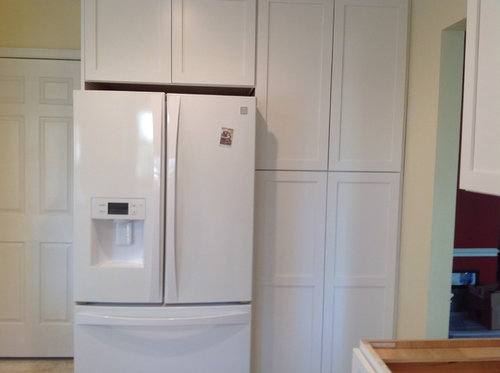
This screenshot has height=373, width=500. Identify the location of wall. (425, 200), (41, 18).